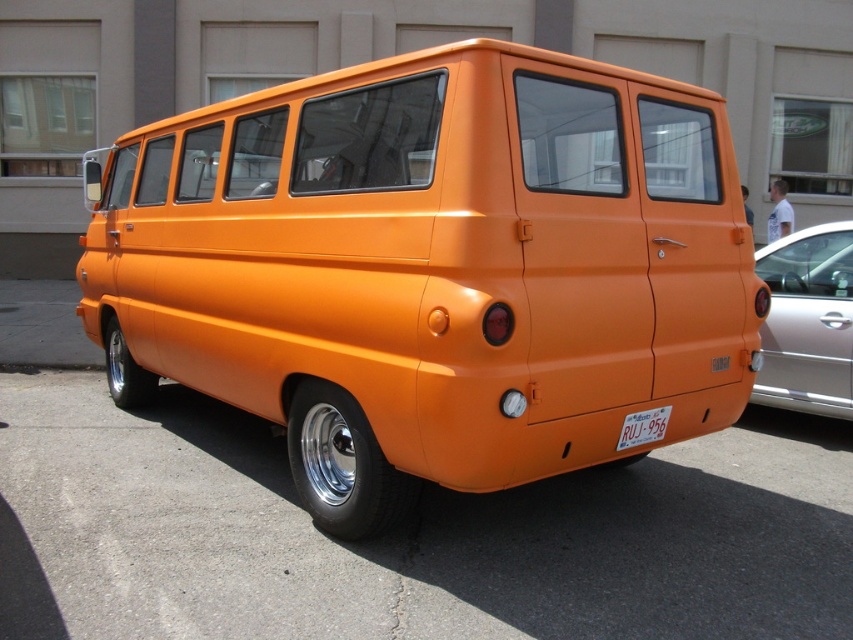
You are a delivery person who needs to load a tall package into your vehicle. You have an orange matte van at center and a metallic silver car at right available. Which vehicle should you choose to ensure the package fits?

The metallic silver car at right has a greater height than the orange matte van at center, so you should choose the metallic silver car at right to ensure the tall package fits.

You are a delivery person who needs to attach a magnetic sign to the orange matte van at center. The sign requires 30 inches of clearance from the white plastic license plate at lower center to avoid interfering with the license plate visibility. Based on the scene, will the van meet this requirement?

The orange matte van at center and white plastic license plate at lower center are 30.23 inches apart from each other. Since the required clearance is 30 inches, the van meets the requirement as the distance is slightly more than needed.

You are standing in front of the vintage orange van and notice two points marked on its surface. One is at point (48, 484) and the other at point (782, 403). Which point is closer to the front of the van?

Point (48, 484) is in front of point (782, 403), so the point closer to the front of the van is point (48, 484).